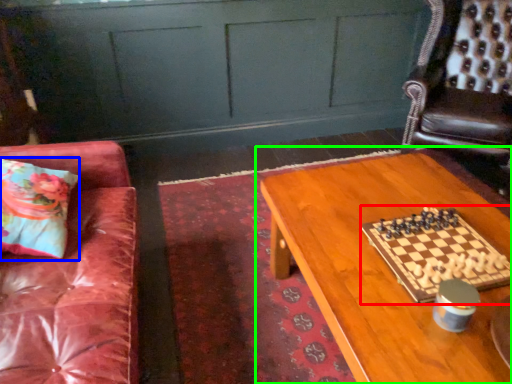
Question: Which object is positioned closest to board game (highlighted by a red box)? Select from pillow (highlighted by a blue box) and table (highlighted by a green box).

Choices:
 (A) pillow
 (B) table

Answer: (B)